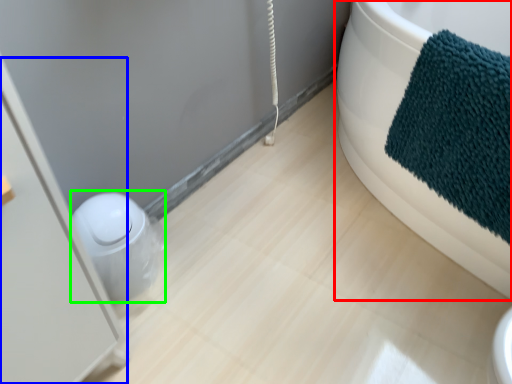
Question: Which object is positioned closest to bathtub (highlighted by a red box)? Select from screen door (highlighted by a blue box) and toilet bowl (highlighted by a green box).

Choices:
 (A) screen door
 (B) toilet bowl

Answer: (B)